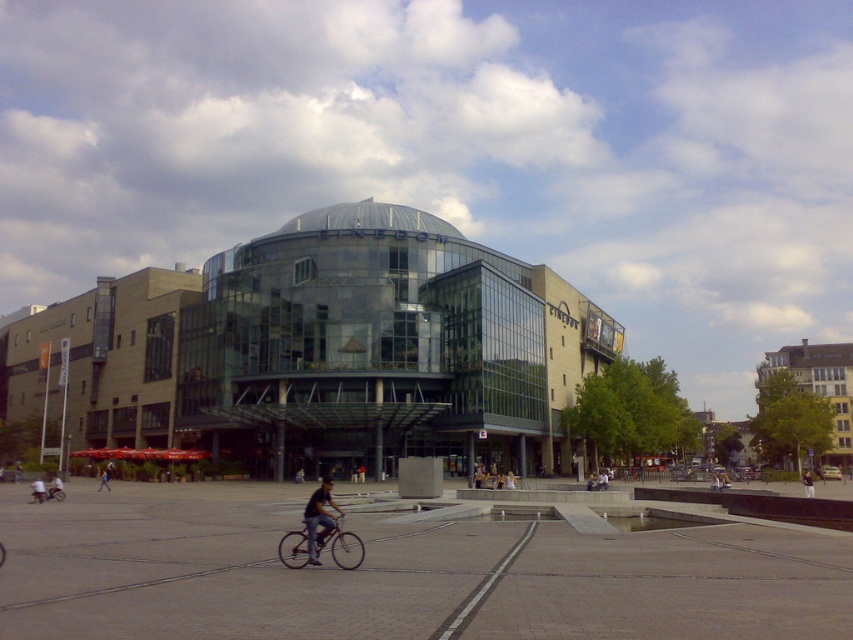
The width and height of the screenshot is (853, 640). Describe the element at coordinates (47, 493) in the screenshot. I see `metallic silver bicycle at lower left` at that location.

Does point (38, 493) come closer to viewer compared to point (61, 496)?

Yes.

Locate an element on the screen. metallic silver bicycle at lower left is located at coordinates (47, 493).

Is light blue jeans at center to the right of denim pants at lower left from the viewer's perspective?

Correct, you'll find light blue jeans at center to the right of denim pants at lower left.

Does point (61, 488) lie in front of point (33, 481)?

That is True.

You are a GUI agent. You are given a task and a screenshot of the screen. Output one action in this format:
    pyautogui.click(x=<x>, y=<y>)
    Task: Click on the light blue jeans at center
    
    Given the screenshot: What is the action you would take?
    pyautogui.click(x=55, y=488)

Measure the distance between denim pants at lower left and camera.

The distance of denim pants at lower left from camera is 60.86 meters.

Is point (33, 486) closer to viewer compared to point (107, 467)?

That is True.

Which is behind, point (41, 496) or point (105, 486)?

Positioned behind is point (105, 486).

Image resolution: width=853 pixels, height=640 pixels. I want to click on denim pants at lower left, so click(x=38, y=490).